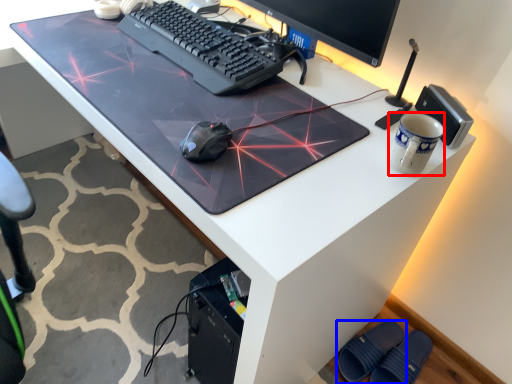
Question: Which object appears closest to the camera in this image, mug (highlighted by a red box) or footwear (highlighted by a blue box)?

Choices:
 (A) mug
 (B) footwear

Answer: (A)